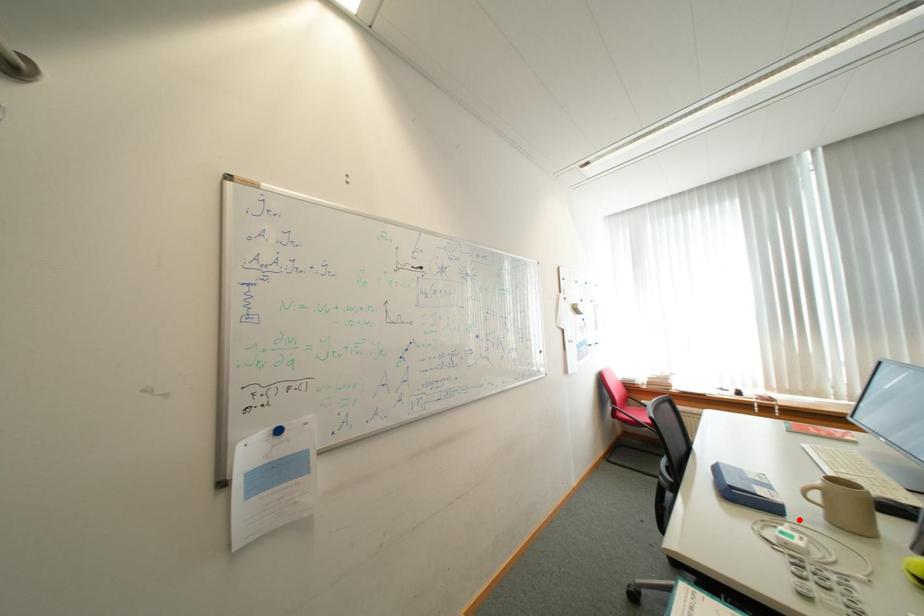
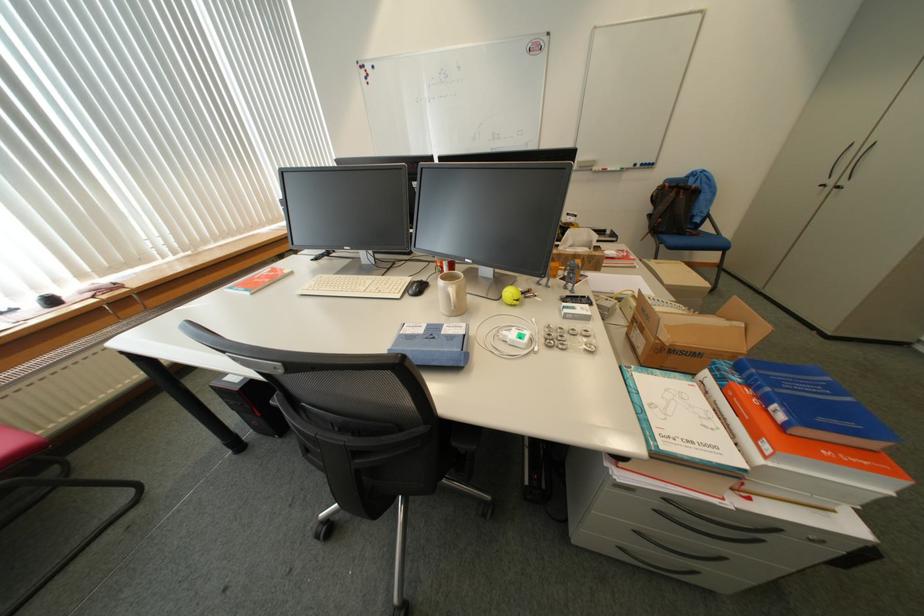
In the second image, find the point that corresponds to the highlighted location in the first image.

(481, 334)